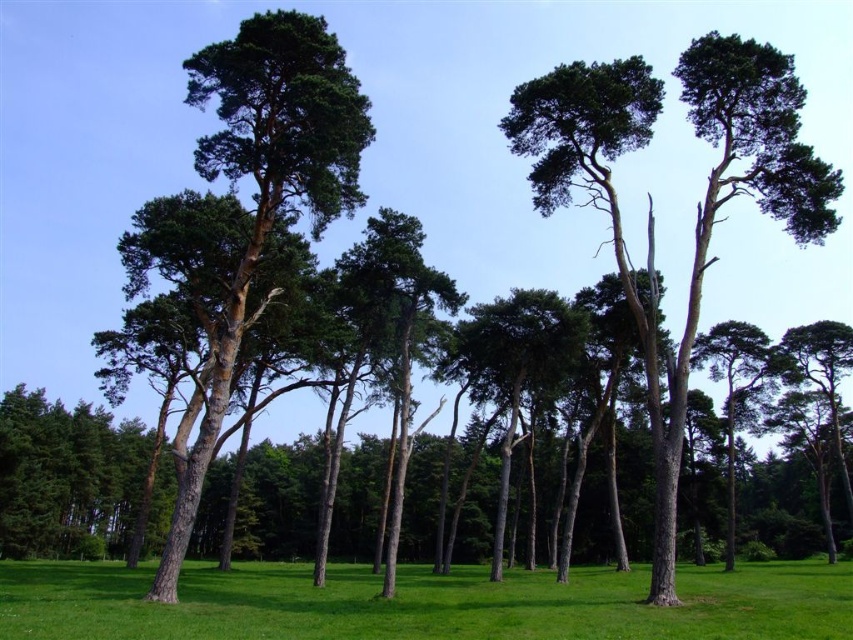
Question: Can you confirm if green grass at center is positioned to the right of green matte tree at center?

Choices:
 (A) yes
 (B) no

Answer: (A)

Question: Which object appears closest to the camera in this image?

Choices:
 (A) green grass at center
 (B) green matte tree at center

Answer: (A)

Question: Which object appears farthest from the camera in this image?

Choices:
 (A) green matte tree at center
 (B) green grass at center

Answer: (A)

Question: Can you confirm if green grass at center is positioned above green matte tree at center?

Choices:
 (A) no
 (B) yes

Answer: (A)

Question: Which point is closer to the camera?

Choices:
 (A) green matte tree at center
 (B) green grass at center

Answer: (B)

Question: Is green grass at center smaller than green matte tree at center?

Choices:
 (A) no
 (B) yes

Answer: (A)